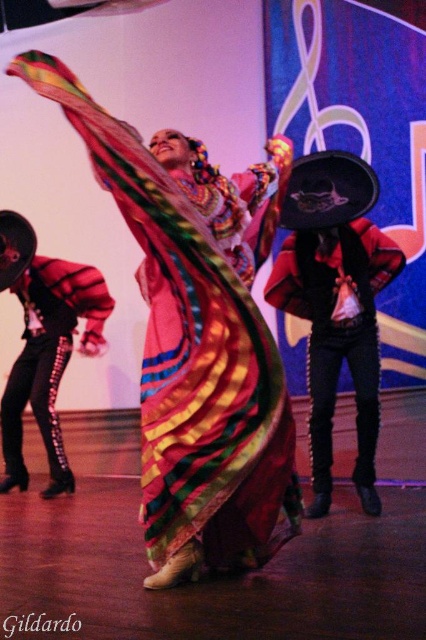
You are a photographer at the dance performance. You want to capture a photo where the silky multicolored skirt at center is visible above the velvet black sombrero at center. Is this possible based on the current positions?

Yes, the silky multicolored skirt at center is already positioned above the velvet black sombrero at center, so capturing such a photo is possible.

What is the position of the silky multicolored skirt at center in the image?

The silky multicolored skirt at center is located at point (196, 339).

What is the position of the silky multicolored skirt at center in the image?

The silky multicolored skirt at center is located at point (196,339).